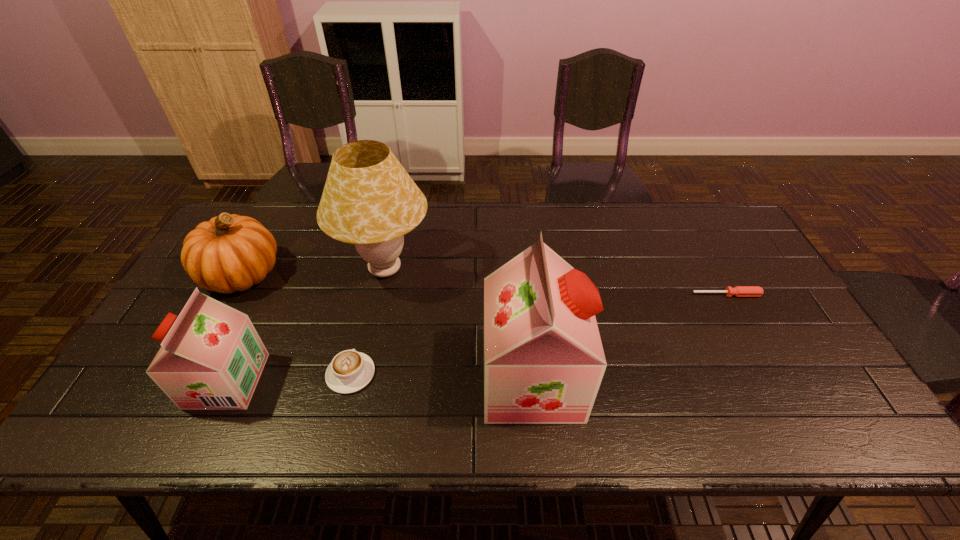
This screenshot has width=960, height=540. Find the location of `free space between the lampshade and the left soya milk`. free space between the lampshade and the left soya milk is located at coordinates (306, 325).

The width and height of the screenshot is (960, 540). In order to click on free spot between the fifth object from left to right and the pumpkin in this screenshot , I will do `click(387, 327)`.

Find the location of a particular element. Image resolution: width=960 pixels, height=540 pixels. free space between the right soya milk and the lampshade is located at coordinates (458, 325).

Identify which object is the third nearest to the pumpkin. Please provide its 2D coordinates. Your answer should be formatted as a tuple, i.e. [(x, y)], where the tuple contains the x and y coordinates of a point satisfying the conditions above.

[(350, 371)]

Select which object appears as the second closest to the pumpkin. Please provide its 2D coordinates. Your answer should be formatted as a tuple, i.e. [(x, y)], where the tuple contains the x and y coordinates of a point satisfying the conditions above.

[(211, 358)]

This screenshot has height=540, width=960. I want to click on vacant space that satisfies the following two spatial constraints: 1. on the front side of the rightmost object; 2. on the right side of the lampshade, so click(x=380, y=295).

Locate an element on the screen. The width and height of the screenshot is (960, 540). vacant space that satisfies the following two spatial constraints: 1. with the handle on the right side of the cappuccino; 2. on the right side of the lampshade is located at coordinates (375, 269).

The image size is (960, 540). I want to click on free space that satisfies the following two spatial constraints: 1. with the handle on the right side of the shortest object; 2. on the right side of the cappuccino, so click(x=370, y=295).